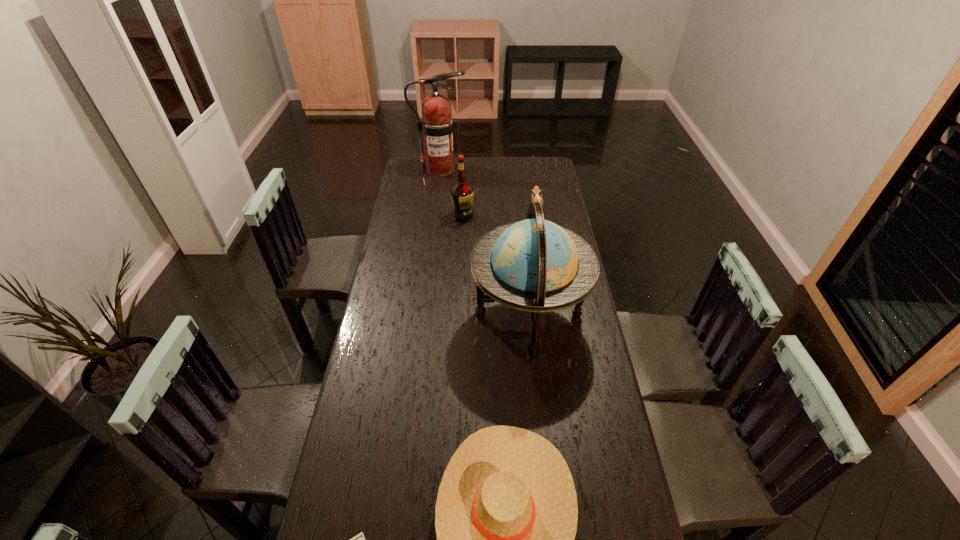
Image resolution: width=960 pixels, height=540 pixels. I want to click on vacant area at the far left corner of the desktop, so point(411,175).

Select which object is the fifth closest to the fourth farthest object. Please provide its 2D coordinates. Your answer should be formatted as a tuple, i.e. [(x, y)], where the tuple contains the x and y coordinates of a point satisfying the conditions above.

[(437, 124)]

Identify the location of object that ranks as the fifth closest to the bird. Image resolution: width=960 pixels, height=540 pixels. (359, 539).

I want to click on vacant space that satisfies the following two spatial constraints: 1. at the beak of the second shortest object; 2. on the label of the third tallest object, so click(538, 216).